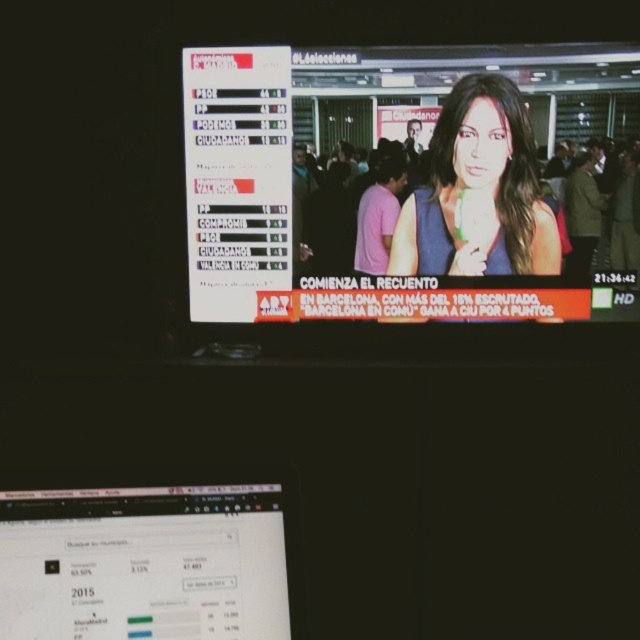
You are a journalist in a newsroom observing the dual screens. The matte white scoreboard at upper center and the matte black screen at lower center are both displaying election updates. Which screen is physically taller?

The matte white scoreboard at upper center is taller than the matte black screen at lower center.

You are a journalist in a newsroom and you need to quickly reference both the matte white scoreboard at upper center and the matte black screen at lower center. Which screen should you look at first if you want to check the latest election results displayed on the scoreboard?

The matte white scoreboard at upper center is to the right of the matte black screen at lower center. Since the scoreboard contains the election results, you should look at the matte white scoreboard at upper center first to check the latest election results.

Looking at this image, you are a journalist standing in front of the dual screens. The matte black screen at lower center and the matte blue dress at center are both visible. Which object is shorter in height?

The matte black screen at lower center is not as tall as the matte blue dress at center, so the matte black screen at lower center is shorter in height.